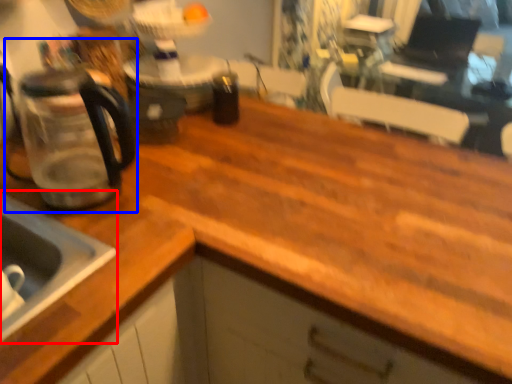
Question: Which of the following is the closest to the observer, sink (highlighted by a red box) or coffeepot (highlighted by a blue box)?

Choices:
 (A) sink
 (B) coffeepot

Answer: (A)